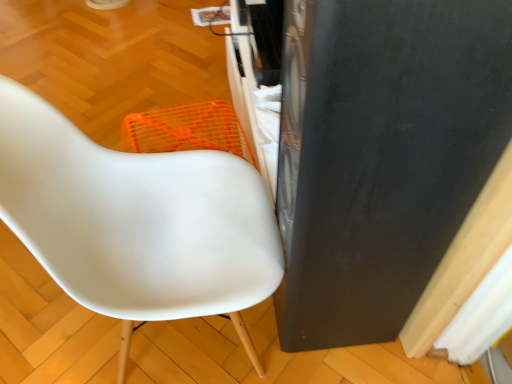
Find the location of a particular element. vacant space underneath white matte chair at center (from a real-world perspective) is located at coordinates (179, 345).